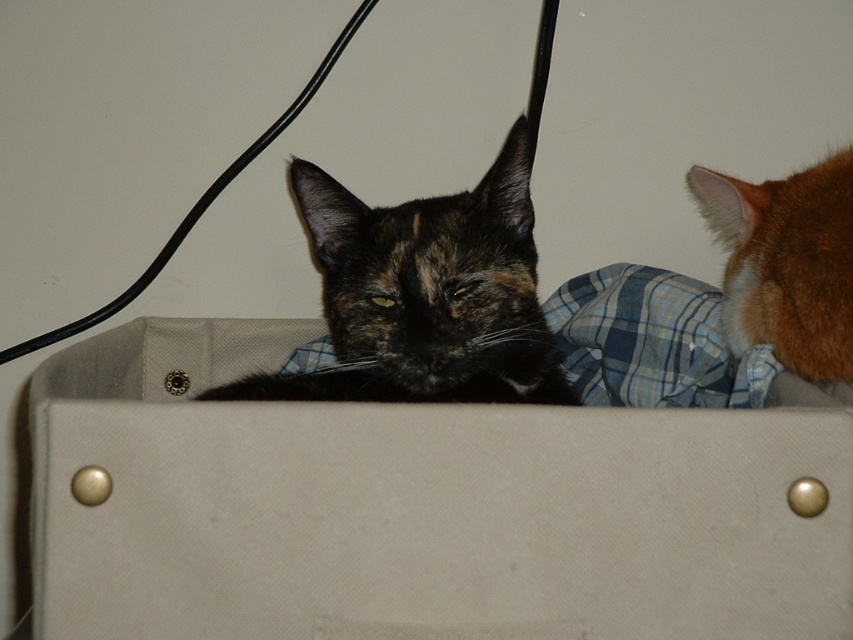
Question: Is beige fabric box at center positioned at the back of orange fur at upper right?

Choices:
 (A) yes
 (B) no

Answer: (B)

Question: Does beige fabric box at center have a larger size compared to tortoiseshell fur cat at center?

Choices:
 (A) no
 (B) yes

Answer: (B)

Question: Which of the following is the closest to the observer?

Choices:
 (A) (422, 346)
 (B) (813, 307)
 (C) (54, 502)

Answer: (C)

Question: Which is farther from the tortoiseshell fur cat at center?

Choices:
 (A) beige fabric box at center
 (B) orange fur at upper right

Answer: (B)

Question: Can you confirm if tortoiseshell fur cat at center is wider than orange fur at upper right?

Choices:
 (A) no
 (B) yes

Answer: (B)

Question: Which of the following is the farthest from the observer?

Choices:
 (A) (498, 392)
 (B) (746, 346)
 (C) (627, 476)

Answer: (B)